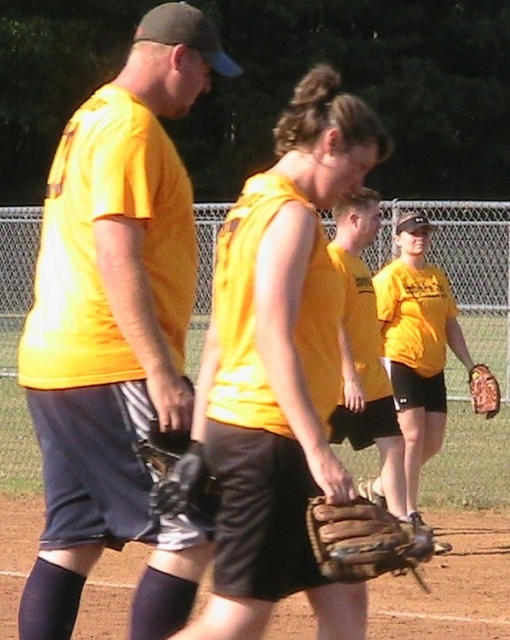
Is yellow matte baseball glove at center shorter than brown leather glove at lower right?

In fact, yellow matte baseball glove at center may be taller than brown leather glove at lower right.

Can you confirm if yellow matte baseball glove at center is positioned below brown leather glove at lower right?

Incorrect, yellow matte baseball glove at center is not positioned below brown leather glove at lower right.

Identify the location of yellow matte baseball glove at center. pos(417,346).

Can you confirm if matte yellow shirt at left is bigger than brown leather glove at center?

No.

Does point (111, 540) come in front of point (415, 547)?

No.

Does point (204, 19) come in front of point (377, 550)?

No, it is not.

This screenshot has height=640, width=510. In order to click on matte yellow shirt at left in this screenshot , I will do `click(116, 330)`.

Does matte yellow shirt at left appear over brown leather glove at lower right?

Indeed, matte yellow shirt at left is positioned over brown leather glove at lower right.

The image size is (510, 640). What do you see at coordinates (116, 330) in the screenshot?
I see `matte yellow shirt at left` at bounding box center [116, 330].

The height and width of the screenshot is (640, 510). What do you see at coordinates (116, 330) in the screenshot?
I see `matte yellow shirt at left` at bounding box center [116, 330].

Identify the location of matte yellow shirt at left. This screenshot has height=640, width=510. (116, 330).